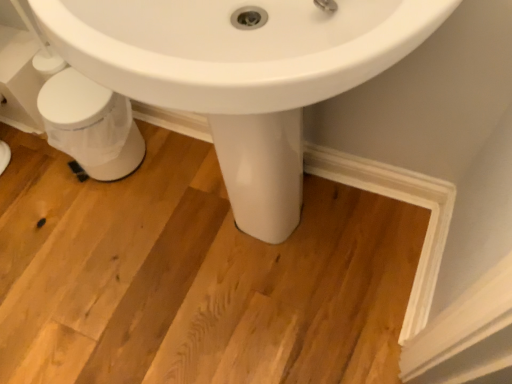
At what (x,y) coordinates should I click in order to perform the action: click on vacant space to the left of white glossy sink at center. Please return your answer as a coordinate pair (x, y). Looking at the image, I should click on (100, 271).